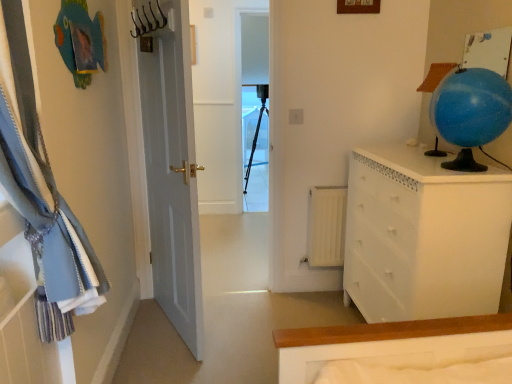
Question: From the image's perspective, is white glossy chest of drawers at right located above metallic hook at upper center?

Choices:
 (A) yes
 (B) no

Answer: (B)

Question: Can you confirm if white glossy chest of drawers at right is positioned to the left of metallic hook at upper center?

Choices:
 (A) no
 (B) yes

Answer: (A)

Question: Is white glossy chest of drawers at right directly adjacent to metallic hook at upper center?

Choices:
 (A) yes
 (B) no

Answer: (B)

Question: From the image's perspective, is white glossy chest of drawers at right located beneath metallic hook at upper center?

Choices:
 (A) no
 (B) yes

Answer: (B)

Question: Is metallic hook at upper center inside white glossy chest of drawers at right?

Choices:
 (A) no
 (B) yes

Answer: (A)

Question: From a real-world perspective, is white glossy chest of drawers at right above or below blue glossy globe at upper right?

Choices:
 (A) below
 (B) above

Answer: (A)

Question: Is white glossy chest of drawers at right wider or thinner than blue glossy globe at upper right?

Choices:
 (A) thin
 (B) wide

Answer: (B)

Question: Considering the positions of white glossy chest of drawers at right and blue glossy globe at upper right in the image, is white glossy chest of drawers at right taller or shorter than blue glossy globe at upper right?

Choices:
 (A) short
 (B) tall

Answer: (B)

Question: Relative to blue glossy globe at upper right, is white glossy chest of drawers at right in front or behind?

Choices:
 (A) front
 (B) behind

Answer: (B)

Question: Considering their positions, is transparent plastic screen door at center located in front of or behind blue fabric curtain at left?

Choices:
 (A) front
 (B) behind

Answer: (B)

Question: Does point (256, 109) appear closer or farther from the camera than point (14, 66)?

Choices:
 (A) closer
 (B) farther

Answer: (B)

Question: In the image, is transparent plastic screen door at center on the left side or the right side of blue fabric curtain at left?

Choices:
 (A) right
 (B) left

Answer: (A)

Question: From the image's perspective, is transparent plastic screen door at center positioned above or below blue fabric curtain at left?

Choices:
 (A) above
 (B) below

Answer: (A)

Question: Is blue fabric curtain at left wider or thinner than transparent plastic screen door at center?

Choices:
 (A) wide
 (B) thin

Answer: (A)

Question: Would you say blue fabric curtain at left is inside or outside transparent plastic screen door at center?

Choices:
 (A) outside
 (B) inside

Answer: (A)